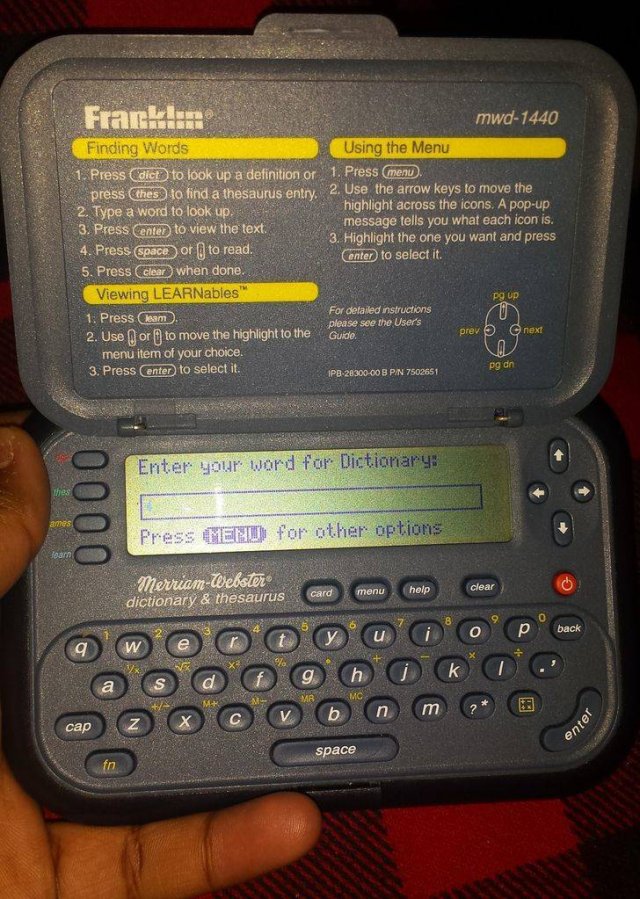
The image size is (640, 899). Identify the location of check blanket. (444, 847).